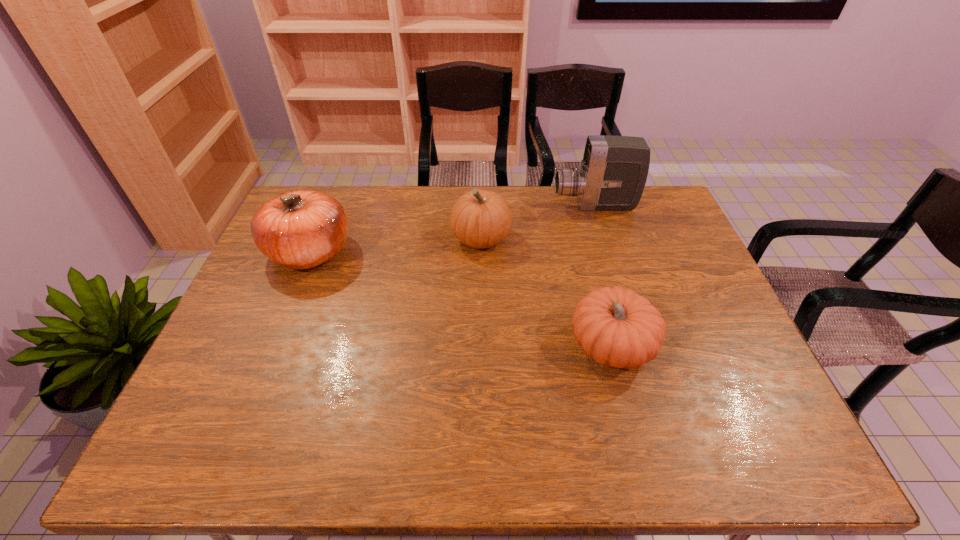
This screenshot has height=540, width=960. I want to click on vacant space in between the second object from left to right and the rightmost pumpkin, so click(546, 292).

Find the location of a particular element. This screenshot has width=960, height=540. free space between the shortest pumpkin and the second pumpkin from right to left is located at coordinates (546, 292).

Where is `vacant region between the leftmost object and the nearest object`? vacant region between the leftmost object and the nearest object is located at coordinates (461, 299).

In order to click on free space between the nearest pumpkin and the camcorder in this screenshot , I will do `click(603, 276)`.

Choose which object is the second nearest neighbor to the leftmost object. Please provide its 2D coordinates. Your answer should be formatted as a tuple, i.e. [(x, y)], where the tuple contains the x and y coordinates of a point satisfying the conditions above.

[(618, 328)]

The height and width of the screenshot is (540, 960). In order to click on the closest object relative to the second pumpkin from left to right in this screenshot , I will do (613, 173).

Where is `pumpkin that is the closest to the leftmost pumpkin`? This screenshot has width=960, height=540. pumpkin that is the closest to the leftmost pumpkin is located at coordinates (479, 219).

Locate which pumpkin ranks second in proximity to the leftmost pumpkin. Please provide its 2D coordinates. Your answer should be formatted as a tuple, i.e. [(x, y)], where the tuple contains the x and y coordinates of a point satisfying the conditions above.

[(618, 328)]

Where is `vacant point that satisfies the following two spatial constraints: 1. on the stem of the shortest pumpkin; 2. on the right side of the second pumpkin from right to left`? The image size is (960, 540). vacant point that satisfies the following two spatial constraints: 1. on the stem of the shortest pumpkin; 2. on the right side of the second pumpkin from right to left is located at coordinates (481, 346).

The width and height of the screenshot is (960, 540). What are the coordinates of `free space that satisfies the following two spatial constraints: 1. on the stem of the second pumpkin from right to left; 2. on the left side of the shortest object` in the screenshot? It's located at (481, 346).